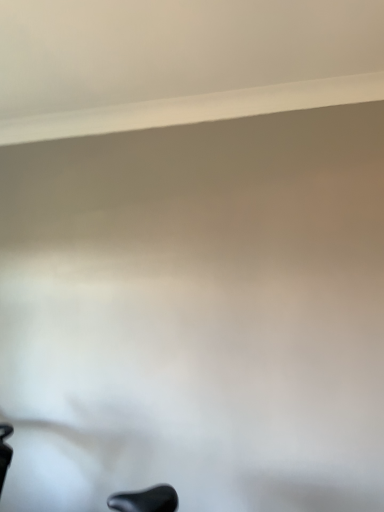
Where is `black matte swivel chair at lower left`? The width and height of the screenshot is (384, 512). black matte swivel chair at lower left is located at coordinates coord(145,500).

What do you see at coordinates (145, 500) in the screenshot? The width and height of the screenshot is (384, 512). I see `black matte swivel chair at lower left` at bounding box center [145, 500].

What is the approximate height of white smooth window sill at upper center?

white smooth window sill at upper center is 3.58 inches in height.

This screenshot has height=512, width=384. What do you see at coordinates (196, 109) in the screenshot? I see `white smooth window sill at upper center` at bounding box center [196, 109].

Locate an element on the screen. Image resolution: width=384 pixels, height=512 pixels. white smooth window sill at upper center is located at coordinates (196, 109).

Where is `black matte swivel chair at lower left`? The height and width of the screenshot is (512, 384). black matte swivel chair at lower left is located at coordinates (145, 500).

Which is more to the right, white smooth window sill at upper center or black matte swivel chair at lower left?

white smooth window sill at upper center is more to the right.

Is the position of white smooth window sill at upper center less distant than that of black matte swivel chair at lower left?

No.

Considering the positions of points (300, 109) and (162, 498), is point (300, 109) closer to camera compared to point (162, 498)?

No, it is not.

From the image's perspective, would you say white smooth window sill at upper center is positioned over black matte swivel chair at lower left?

Yes.

From a real-world perspective, which object rests below the other?

In real-world perspective, black matte swivel chair at lower left is lower.

Does white smooth window sill at upper center have a greater width compared to black matte swivel chair at lower left?

No.

Does white smooth window sill at upper center have a greater height compared to black matte swivel chair at lower left?

Incorrect, the height of white smooth window sill at upper center is not larger of that of black matte swivel chair at lower left.

Can you confirm if white smooth window sill at upper center is smaller than black matte swivel chair at lower left?

Indeed, white smooth window sill at upper center has a smaller size compared to black matte swivel chair at lower left.

Is white smooth window sill at upper center positioned beyond the bounds of black matte swivel chair at lower left?

That's correct, white smooth window sill at upper center is outside of black matte swivel chair at lower left.

Are white smooth window sill at upper center and black matte swivel chair at lower left making contact?

No, white smooth window sill at upper center is not beside black matte swivel chair at lower left.

Is black matte swivel chair at lower left at the back of white smooth window sill at upper center?

white smooth window sill at upper center does not have its back to black matte swivel chair at lower left.

Measure the distance from white smooth window sill at upper center to black matte swivel chair at lower left.

white smooth window sill at upper center is 1.62 meters from black matte swivel chair at lower left.

Where is `window sill above the black matte swivel chair at lower left (from a real-world perspective)`? window sill above the black matte swivel chair at lower left (from a real-world perspective) is located at coordinates (196, 109).

Between black matte swivel chair at lower left and white smooth window sill at upper center, which one appears on the right side from the viewer's perspective?

From the viewer's perspective, white smooth window sill at upper center appears more on the right side.

Considering their positions, is black matte swivel chair at lower left located in front of or behind white smooth window sill at upper center?

black matte swivel chair at lower left is in front of white smooth window sill at upper center.

Considering the points (163, 498) and (96, 109), which point is in front, point (163, 498) or point (96, 109)?

The point (163, 498) is more forward.

From the image's perspective, which one is positioned higher, black matte swivel chair at lower left or white smooth window sill at upper center?

white smooth window sill at upper center is shown above in the image.

From a real-world perspective, does black matte swivel chair at lower left stand above white smooth window sill at upper center?

No.

Which object is wider, black matte swivel chair at lower left or white smooth window sill at upper center?

With larger width is black matte swivel chair at lower left.

Looking at this image, is black matte swivel chair at lower left taller than white smooth window sill at upper center?

Indeed, black matte swivel chair at lower left has a greater height compared to white smooth window sill at upper center.

Does black matte swivel chair at lower left have a smaller size compared to white smooth window sill at upper center?

Incorrect, black matte swivel chair at lower left is not smaller in size than white smooth window sill at upper center.

Is black matte swivel chair at lower left positioned beyond the bounds of white smooth window sill at upper center?

Yes.

Is black matte swivel chair at lower left beside white smooth window sill at upper center?

black matte swivel chair at lower left and white smooth window sill at upper center are clearly separated.

Looking at this image, could you tell me if black matte swivel chair at lower left is facing white smooth window sill at upper center?

No.

Can you tell me how much black matte swivel chair at lower left and white smooth window sill at upper center differ in facing direction?

The angle between the facing direction of black matte swivel chair at lower left and the facing direction of white smooth window sill at upper center is 0.658 degrees.

At what (x,y) coordinates should I click in order to perform the action: click on swivel chair in front of the white smooth window sill at upper center. Please return your answer as a coordinate pair (x, y). The height and width of the screenshot is (512, 384). Looking at the image, I should click on (145, 500).

Find the location of a particular element. Image resolution: width=384 pixels, height=512 pixels. swivel chair that appears below the white smooth window sill at upper center (from the image's perspective) is located at coordinates (145, 500).

Locate an element on the screen. The height and width of the screenshot is (512, 384). swivel chair below the white smooth window sill at upper center (from a real-world perspective) is located at coordinates (145, 500).